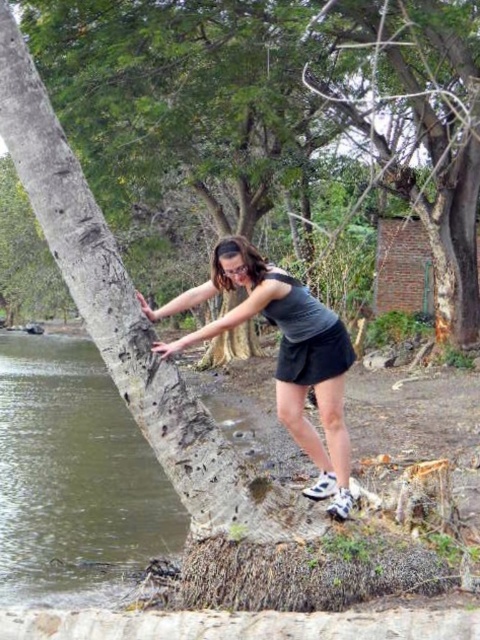
You are a hiker trying to cross a river using the uprooted tree trunk. The point labeled as point (x=288, y=92) is part of the rough bark tree at left. Which direction should you step towards to avoid the water?

The rough bark tree at left is represented by point (x=288, y=92). To avoid the water, you should step towards the rough bark tree at left since it is the solid part of the uprooted trunk and the water is on the opposite side.